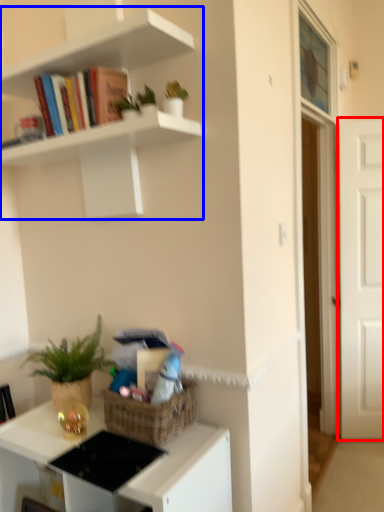
Question: Which of the following is the farthest to the observer, door (highlighted by a red box) or shelf (highlighted by a blue box)?

Choices:
 (A) door
 (B) shelf

Answer: (A)